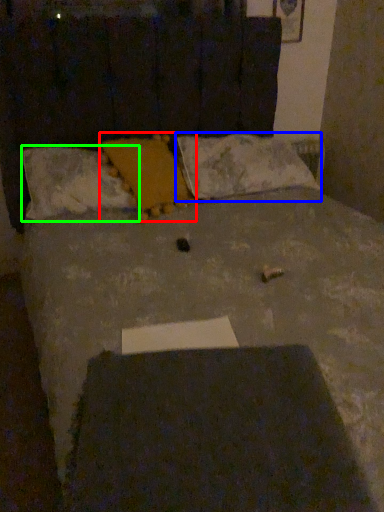
Question: Which object is positioned closest to pillow (highlighted by a red box)? Select from pillow (highlighted by a blue box) and pillow (highlighted by a green box).

Choices:
 (A) pillow
 (B) pillow

Answer: (B)